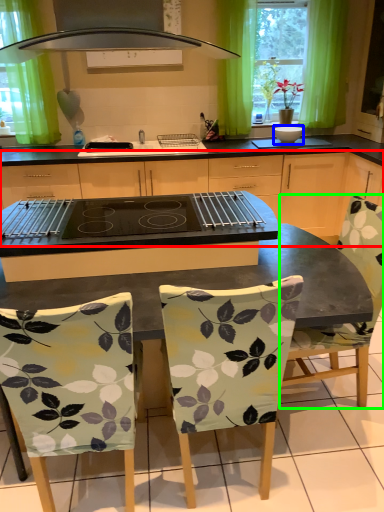
Question: Which object is the closest to the cabinetry (highlighted by a red box)? Choose among these: appliance (highlighted by a blue box) or chair (highlighted by a green box).

Choices:
 (A) appliance
 (B) chair

Answer: (A)